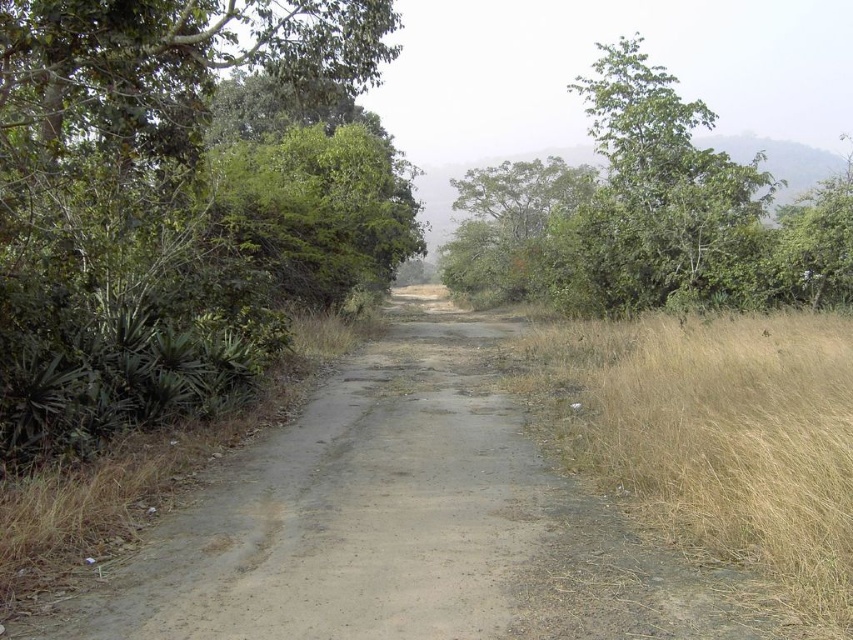
Question: Among these points, which one is farthest from the camera?

Choices:
 (A) (567, 216)
 (B) (740, 480)
 (C) (230, 118)

Answer: (A)

Question: Can you confirm if green leafy tree at left is positioned above green leafy tree at upper center?

Choices:
 (A) no
 (B) yes

Answer: (A)

Question: Where is green leafy tree at left located in relation to dry grass at right in the image?

Choices:
 (A) below
 (B) above

Answer: (B)

Question: Is green leafy tree at left to the right of green leafy tree at upper center from the viewer's perspective?

Choices:
 (A) no
 (B) yes

Answer: (A)

Question: Among these points, which one is nearest to the camera?

Choices:
 (A) (836, 508)
 (B) (283, 307)
 (C) (515, 202)

Answer: (A)

Question: Which of these objects is positioned farthest from the green leafy tree at left?

Choices:
 (A) green leafy tree at upper center
 (B) dry grass at right

Answer: (A)